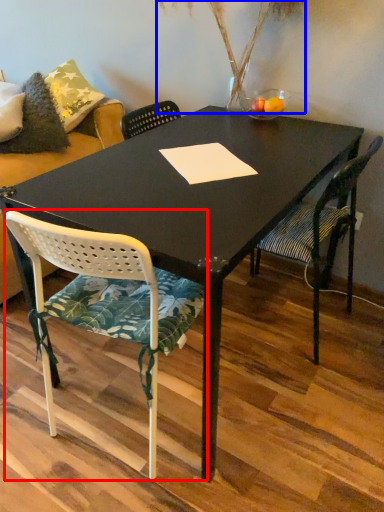
Question: Which point is closer to the camera, chair (highlighted by a red box) or plant (highlighted by a blue box)?

Choices:
 (A) chair
 (B) plant

Answer: (A)